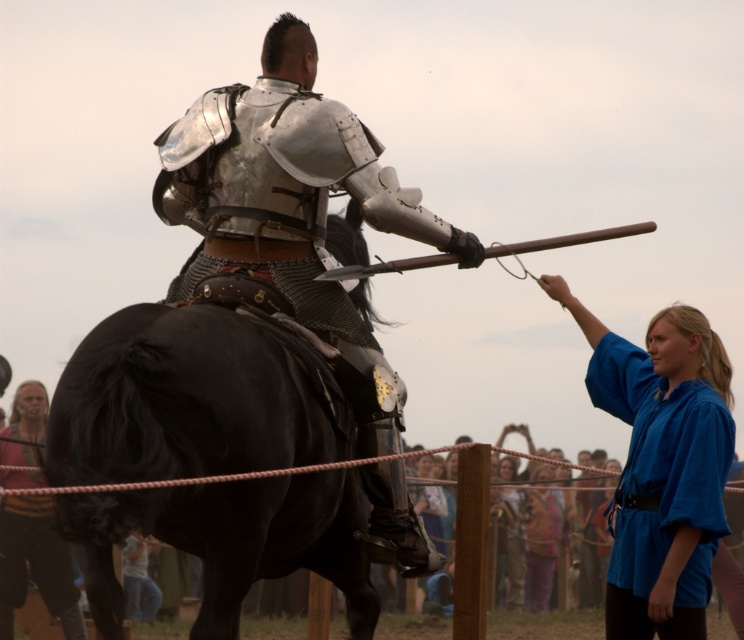
Question: Which point appears closest to the camera in this image?

Choices:
 (A) (722, 419)
 (B) (548, 490)

Answer: (A)

Question: Does blue cotton shirt at upper right have a lesser width compared to blue cotton shirt at center?

Choices:
 (A) no
 (B) yes

Answer: (A)

Question: Which of the following is the closest to the observer?

Choices:
 (A) matte red shirt at lower left
 (B) shiny metallic armor at center

Answer: (A)

Question: Can you confirm if shiny metallic armor at center is smaller than matte red shirt at lower left?

Choices:
 (A) yes
 (B) no

Answer: (A)

Question: Observing the image, what is the correct spatial positioning of blue cotton shirt at upper right in reference to blue cotton shirt at center?

Choices:
 (A) below
 (B) above

Answer: (B)

Question: Which of the following is the farthest from the observer?

Choices:
 (A) (376, 372)
 (B) (535, 499)

Answer: (B)